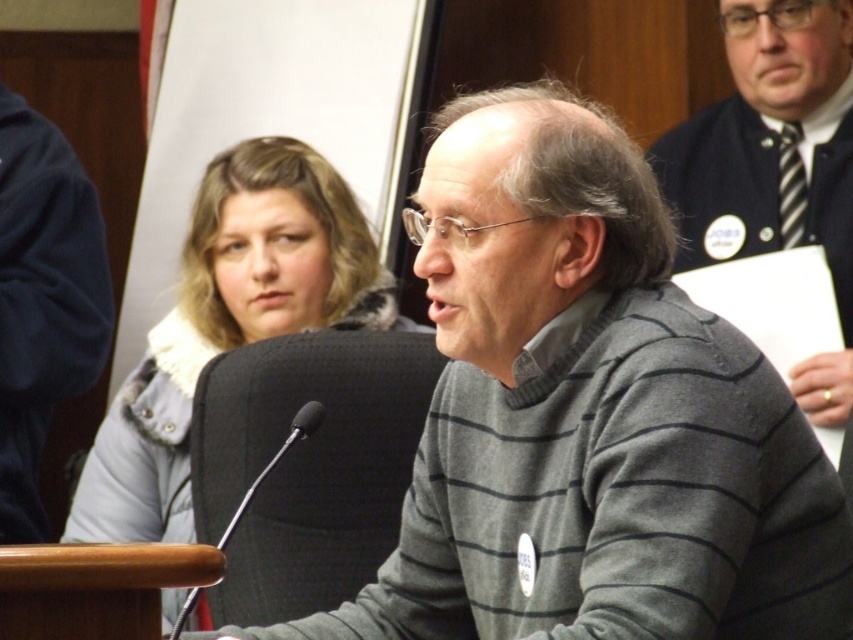
Is gray fur-trimmed coat at upper center below striped sweater at upper right?

Yes, gray fur-trimmed coat at upper center is below striped sweater at upper right.

What do you see at coordinates (230, 323) in the screenshot? The width and height of the screenshot is (853, 640). I see `gray fur-trimmed coat at upper center` at bounding box center [230, 323].

The height and width of the screenshot is (640, 853). Find the location of `gray fur-trimmed coat at upper center`. gray fur-trimmed coat at upper center is located at coordinates (230, 323).

I want to click on gray striped sweater at center, so click(x=587, y=417).

Between gray striped sweater at center and gray fur-trimmed coat at upper center, which one is positioned lower?

Positioned lower is gray striped sweater at center.

Who is more distant from viewer, (602, 460) or (144, 480)?

The point (144, 480) is more distant.

You are a GUI agent. You are given a task and a screenshot of the screen. Output one action in this format:
    pyautogui.click(x=<x>, y=<y>)
    Task: Click on the gray striped sweater at center
    
    Given the screenshot: What is the action you would take?
    pyautogui.click(x=587, y=417)

Measure the distance between gray striped sweater at center and camera.

1.41 meters

Can you confirm if gray striped sweater at center is wider than striped sweater at upper right?

Yes, gray striped sweater at center is wider than striped sweater at upper right.

Who is more distant from viewer, [500,438] or [849,70]?

The point [849,70] is behind.

You are a GUI agent. You are given a task and a screenshot of the screen. Output one action in this format:
    pyautogui.click(x=<x>, y=<y>)
    Task: Click on the gray striped sweater at center
    This screenshot has width=853, height=640.
    Given the screenshot: What is the action you would take?
    pyautogui.click(x=587, y=417)